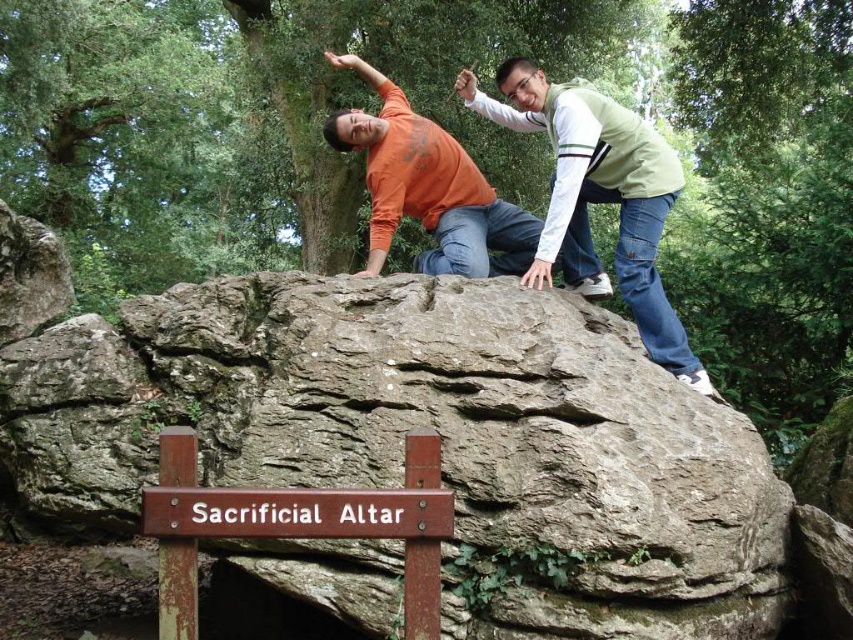
You are a hiker trying to locate the sacrificial altar mentioned in a local legend. You see the green textured vest at upper right and the brown wooden sign at lower center. Which object is taller and would be more visible from a distance?

The green textured vest at upper right is much taller than the brown wooden sign at lower center, so it would be more visible from a distance.

You are hiking and come across a rock formation with a brown wooden sign at lower center and an orange matte shirt at upper center. Which object is positioned higher from the ground?

The orange matte shirt at upper center is positioned higher from the ground than the brown wooden sign at lower center.

You are a hiker who just arrived at the Sacrificial Altar. You need to place a small offering on the exact spot where the green textured vest at upper right is located. What are the coordinates of that location?

The coordinates of the green textured vest at upper right are at point (598,198).